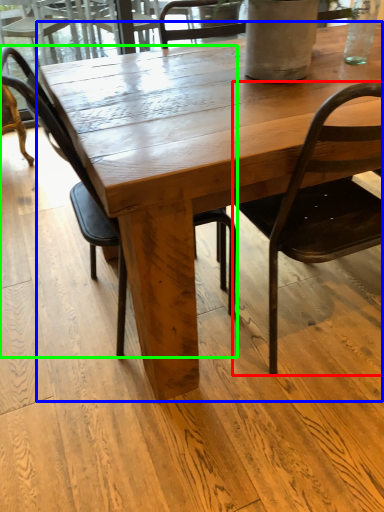
Question: Estimate the real-world distances between objects in this image. Which object is farther from chair (highlighted by a red box), coffee table (highlighted by a blue box) or chair (highlighted by a green box)?

Choices:
 (A) coffee table
 (B) chair

Answer: (B)